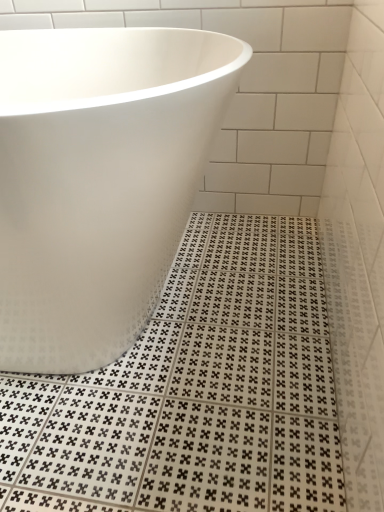
Identify the location of white matte bathtub at center. The image size is (384, 512). (99, 180).

Measure the distance between point (63, 264) and camera.

Point (63, 264) and camera are 25.35 inches apart from each other.

What do you see at coordinates (99, 180) in the screenshot? Image resolution: width=384 pixels, height=512 pixels. I see `white matte bathtub at center` at bounding box center [99, 180].

Where is `white matte bathtub at center`? The image size is (384, 512). white matte bathtub at center is located at coordinates (99, 180).